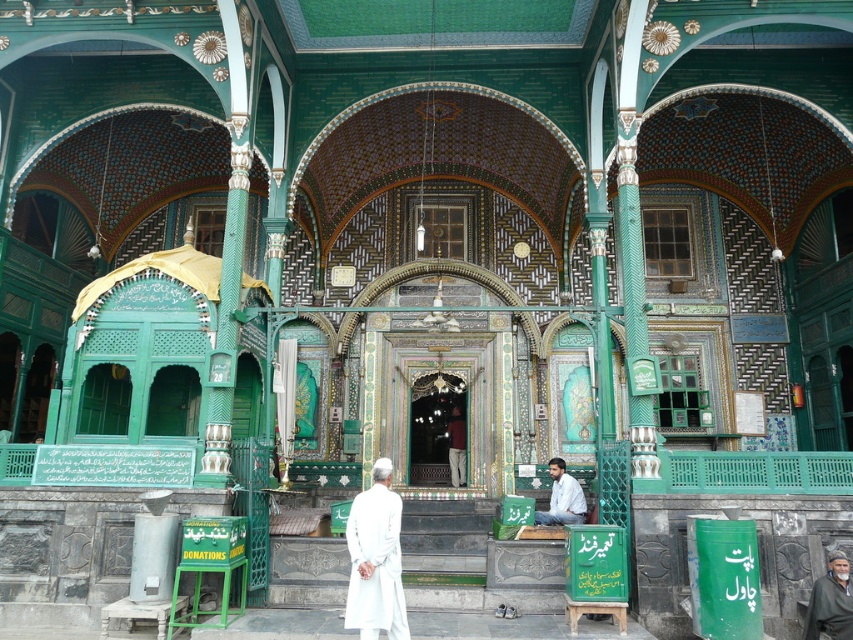
Question: Based on their relative distances, which object is farther from the dark green fabric robe at center?

Choices:
 (A) white fabric person at center
 (B) white cotton robe at center

Answer: (B)

Question: Is dark green fabric robe at center below white fabric person at center?

Choices:
 (A) no
 (B) yes

Answer: (B)

Question: Is white cotton robe at center smaller than dark green fabric robe at center?

Choices:
 (A) no
 (B) yes

Answer: (A)

Question: Which point appears farthest from the camera in this image?

Choices:
 (A) (567, 476)
 (B) (367, 580)

Answer: (A)

Question: Which object appears farthest from the camera in this image?

Choices:
 (A) dark green fabric robe at center
 (B) white cotton robe at center
 (C) white fabric person at center

Answer: (C)

Question: Does white cotton robe at center appear under white fabric person at center?

Choices:
 (A) no
 (B) yes

Answer: (A)